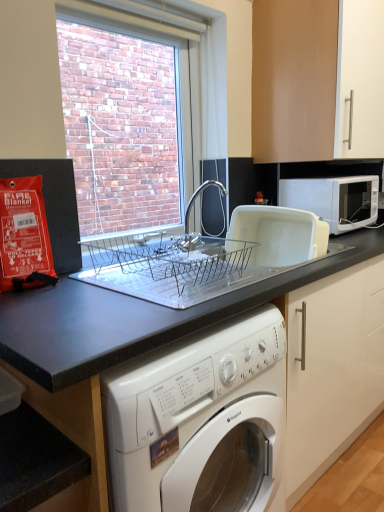
Question: Are black granite countertop at center and clear glass window screen at upper center beside each other?

Choices:
 (A) yes
 (B) no

Answer: (B)

Question: Can you confirm if black granite countertop at center is shorter than clear glass window screen at upper center?

Choices:
 (A) no
 (B) yes

Answer: (A)

Question: Considering the relative sizes of black granite countertop at center and clear glass window screen at upper center in the image provided, is black granite countertop at center smaller than clear glass window screen at upper center?

Choices:
 (A) no
 (B) yes

Answer: (A)

Question: Would you say black granite countertop at center is a long distance from clear glass window screen at upper center?

Choices:
 (A) no
 (B) yes

Answer: (A)

Question: Does black granite countertop at center have a lesser width compared to clear glass window screen at upper center?

Choices:
 (A) yes
 (B) no

Answer: (B)

Question: Is clear glass window screen at upper center inside black granite countertop at center?

Choices:
 (A) yes
 (B) no

Answer: (B)

Question: Is black granite countertop at center to the right of white matte microwave at upper right from the viewer's perspective?

Choices:
 (A) yes
 (B) no

Answer: (B)

Question: Does black granite countertop at center contain white matte microwave at upper right?

Choices:
 (A) yes
 (B) no

Answer: (B)

Question: From a real-world perspective, is black granite countertop at center physically above white matte microwave at upper right?

Choices:
 (A) yes
 (B) no

Answer: (B)

Question: Is black granite countertop at center outside of white matte microwave at upper right?

Choices:
 (A) no
 (B) yes

Answer: (B)

Question: Is there a large distance between black granite countertop at center and white matte microwave at upper right?

Choices:
 (A) no
 (B) yes

Answer: (A)

Question: Could you tell me if black granite countertop at center is turned towards white matte microwave at upper right?

Choices:
 (A) no
 (B) yes

Answer: (A)

Question: Is white plastic dish drainer at upper right shorter than black granite countertop at center?

Choices:
 (A) yes
 (B) no

Answer: (A)